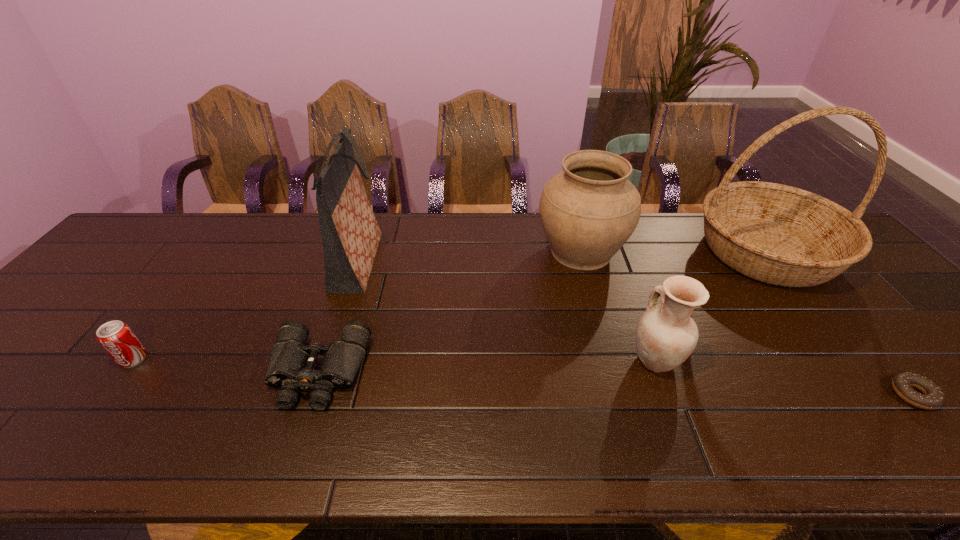
This screenshot has width=960, height=540. In the image, there is a desktop. Identify the location of vacant space at the far edge. (647, 246).

The image size is (960, 540). In the image, there is a desktop. Find the location of `vacant region at the near edge`. vacant region at the near edge is located at coordinates (591, 432).

Where is `vacant area at the left edge`? This screenshot has width=960, height=540. vacant area at the left edge is located at coordinates (105, 300).

Image resolution: width=960 pixels, height=540 pixels. I want to click on free location at the right edge, so click(x=860, y=284).

Identify the location of vacant point located between the sixth shortest object and the fourth tallest object. (507, 310).

Where is `vacant area that lies between the third tallest object and the shortest object`? The image size is (960, 540). vacant area that lies between the third tallest object and the shortest object is located at coordinates (747, 323).

Locate an element on the screen. The width and height of the screenshot is (960, 540). free point between the fifth tallest object and the second shortest object is located at coordinates (226, 366).

Locate an element on the screen. unoccupied position between the fifth tallest object and the shopping bag is located at coordinates (246, 310).

At what (x,y) coordinates should I click in order to perform the action: click on free space that is in between the urn and the pottery. Please return your answer as a coordinate pair (x, y). This screenshot has width=960, height=540. Looking at the image, I should click on (618, 306).

The image size is (960, 540). Identify the location of vacant area that lies between the urn and the binoculars. (449, 312).